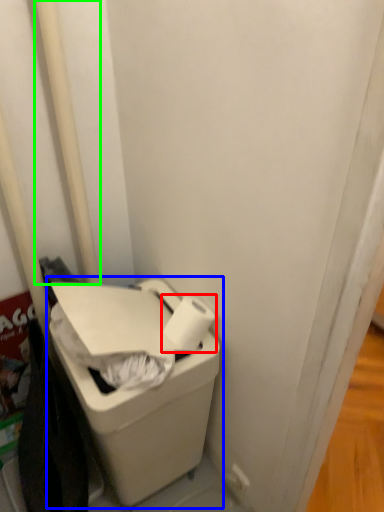
Question: Based on their relative distances, which object is farther from toilet paper (highlighted by a red box)? Choose from waste container (highlighted by a blue box) and pole (highlighted by a green box).

Choices:
 (A) waste container
 (B) pole

Answer: (B)